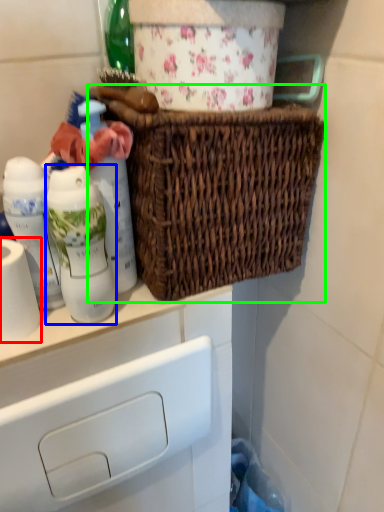
Question: Estimate the real-world distances between objects in this image. Which object is farther from toilet paper (highlighted by a red box), bottle (highlighted by a blue box) or picnic basket (highlighted by a green box)?

Choices:
 (A) bottle
 (B) picnic basket

Answer: (B)